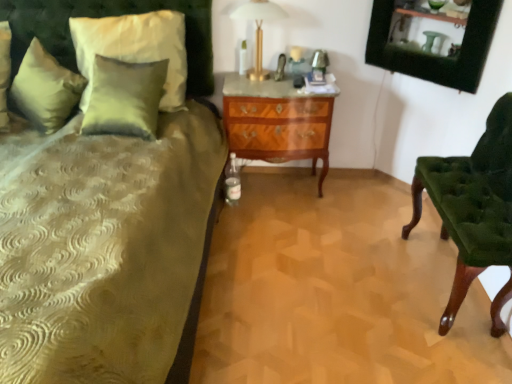
The image size is (512, 384). I want to click on vacant space underneath velvet green chair at right (from a real-world perspective), so click(443, 283).